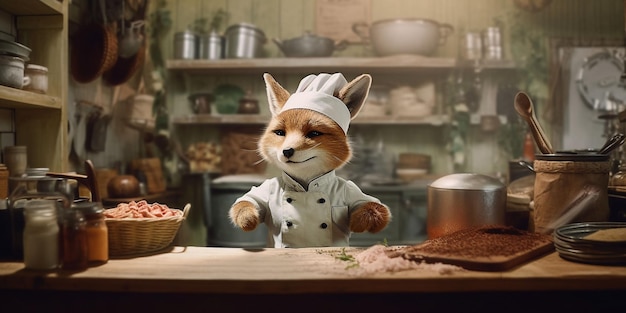
At what (x,y) coordinates should I click in order to perform the action: click on pots. Please return your answer as a coordinate pair (x, y). The image size is (626, 313). Looking at the image, I should click on (186, 47), (213, 44), (240, 43), (315, 47), (397, 39), (470, 206).